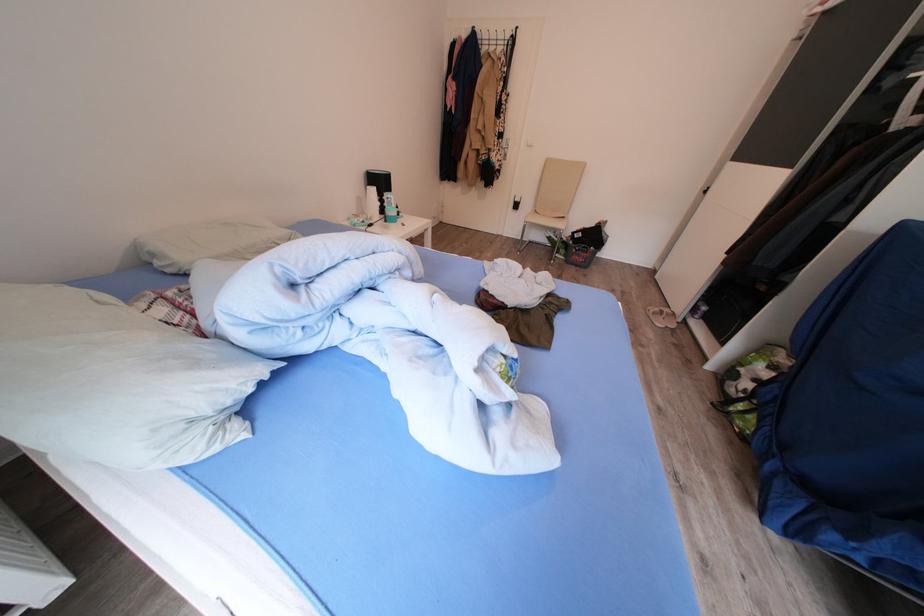
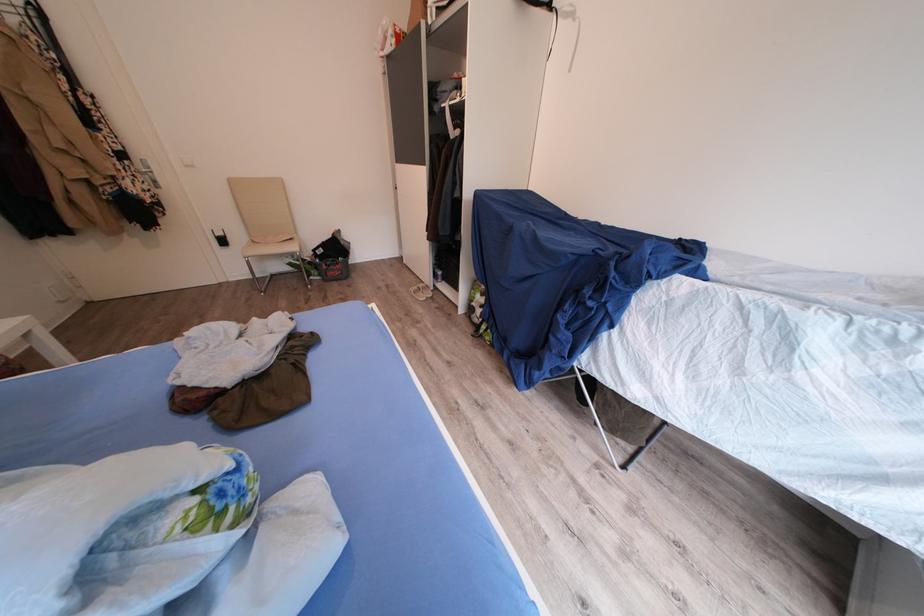
Where in the second image is the point corresponding to pixel 574 261 from the first image?

(329, 281)